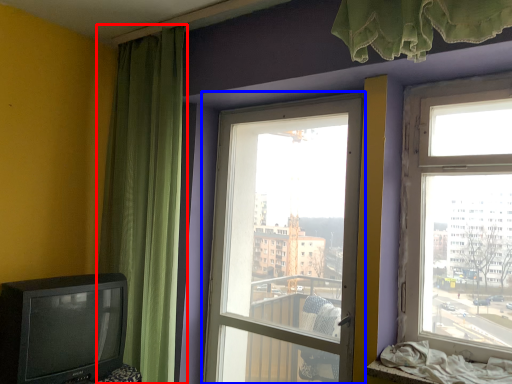
Question: Which object appears closest to the camera in this image, curtain (highlighted by a red box) or window (highlighted by a blue box)?

Choices:
 (A) curtain
 (B) window

Answer: (B)